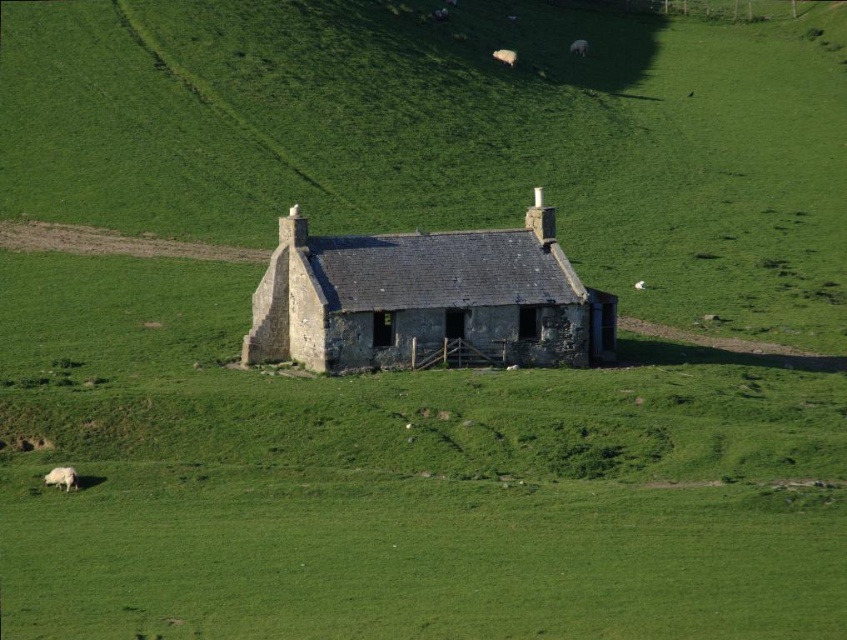
Is point (309, 240) farther from viewer compared to point (508, 60)?

No, it is in front of (508, 60).

The height and width of the screenshot is (640, 847). Identify the location of stone slate roof cottage at center. (425, 298).

Does white woolly sheep at lower left have a greater width compared to white woolly sheep at center?

In fact, white woolly sheep at lower left might be narrower than white woolly sheep at center.

Does point (59, 481) come farther from viewer compared to point (579, 49)?

That is False.

At what (x,y) coordinates should I click in order to perform the action: click on white woolly sheep at lower left. Please return your answer as a coordinate pair (x, y). This screenshot has height=640, width=847. Looking at the image, I should click on (61, 477).

This screenshot has width=847, height=640. In order to click on white woolly sheep at lower left in this screenshot , I will do `click(61, 477)`.

Can you confirm if white woolly sheep at lower left is positioned to the left of white woolly sheep at upper center?

Yes, white woolly sheep at lower left is to the left of white woolly sheep at upper center.

Between point (56, 484) and point (510, 54), which one is positioned in front?

Point (56, 484)

At what (x,y) coordinates should I click in order to perform the action: click on white woolly sheep at lower left. Please return your answer as a coordinate pair (x, y). This screenshot has height=640, width=847. Looking at the image, I should click on (61, 477).